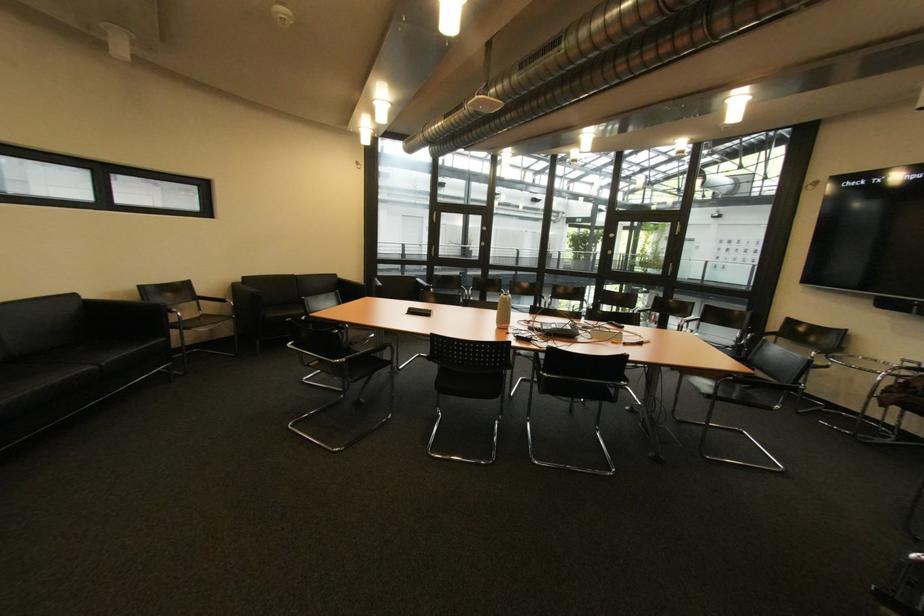
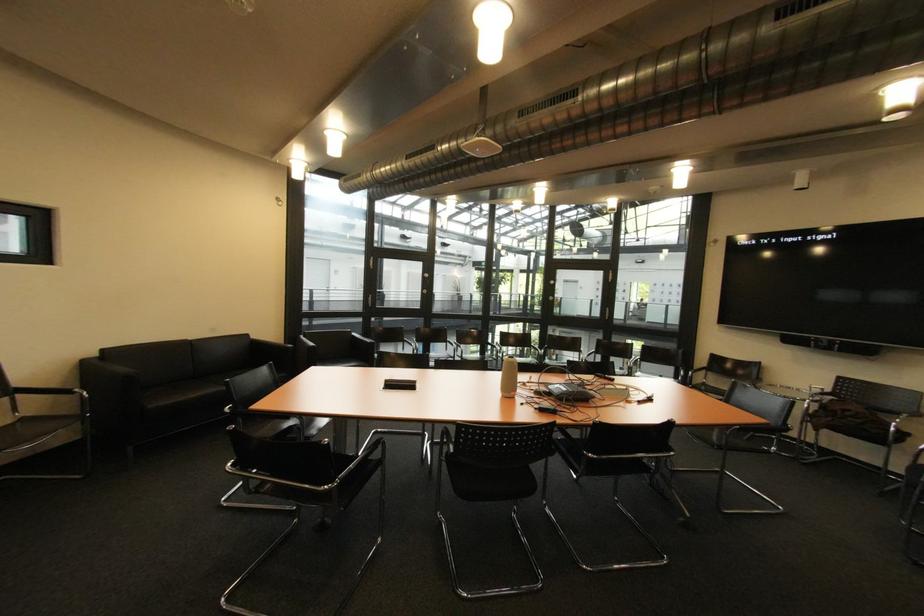
Looking at this image, the images are taken continuously from a first-person perspective. In which direction are you moving?

The movement direction of the cameraman is left, forward.